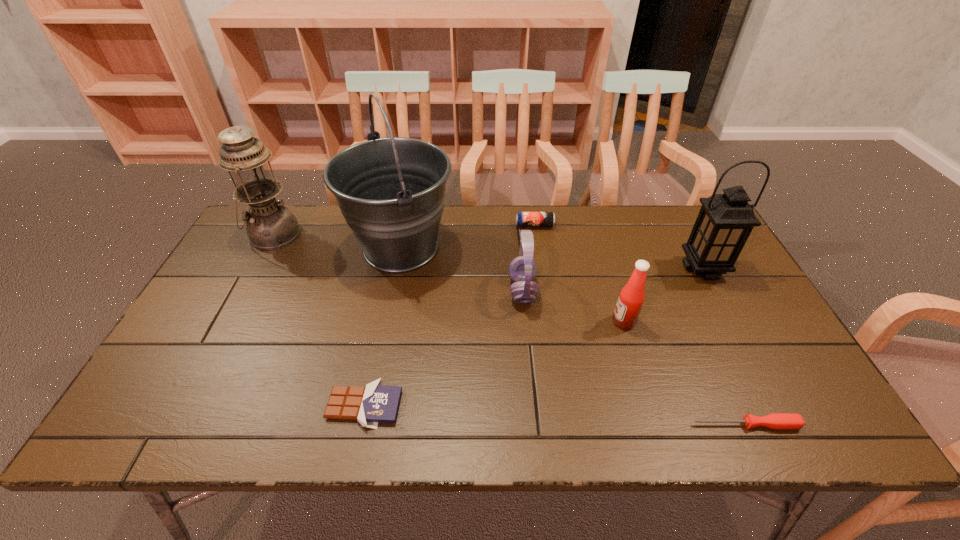
Where is `vacant space that satisfies the following two spatial constraints: 1. on the back side of the oil lamp; 2. on the right side of the beer can`? vacant space that satisfies the following two spatial constraints: 1. on the back side of the oil lamp; 2. on the right side of the beer can is located at coordinates (279, 225).